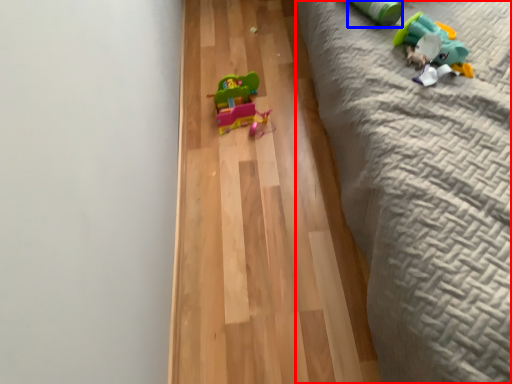
Question: Among these objects, which one is nearest to the camera, bed (highlighted by a red box) or toy (highlighted by a blue box)?

Choices:
 (A) bed
 (B) toy

Answer: (A)